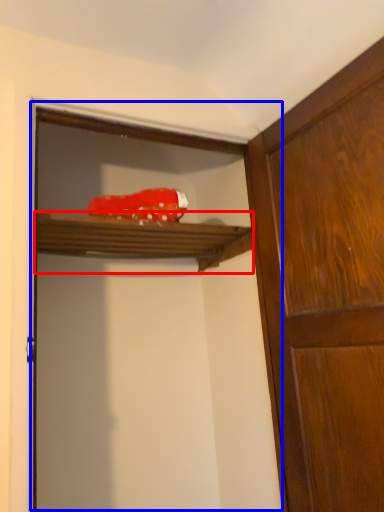
Question: Which object appears closest to the camera in this image, shelf (highlighted by a red box) or screen door (highlighted by a blue box)?

Choices:
 (A) shelf
 (B) screen door

Answer: (B)